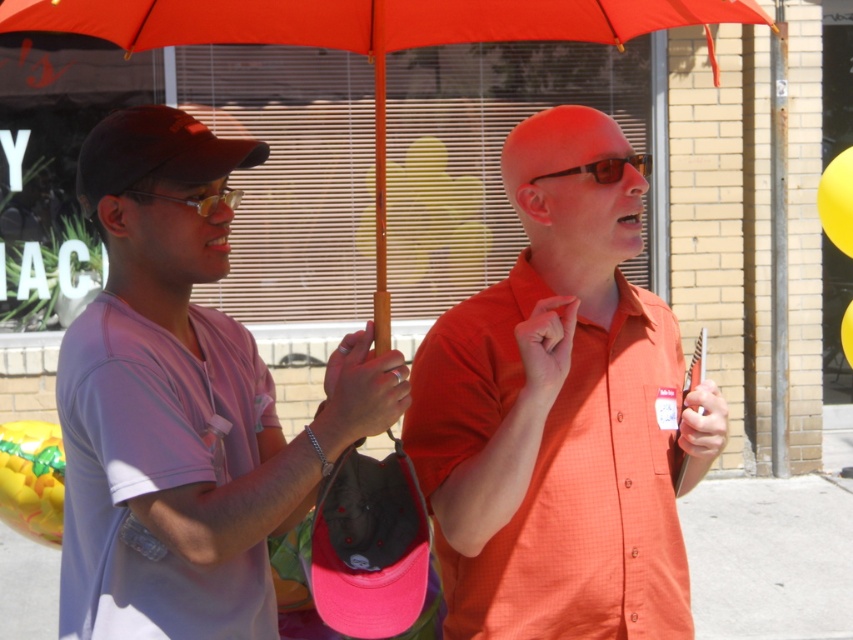
Question: Is yellow matte balloon at upper right positioned before matte yellow goggles at center?

Choices:
 (A) no
 (B) yes

Answer: (A)

Question: Is orange matte shirt at center behind matte yellow goggles at center?

Choices:
 (A) yes
 (B) no

Answer: (B)

Question: From the image, what is the correct spatial relationship of orange matte shirt at center in relation to yellow rubber balloon at upper right?

Choices:
 (A) left
 (B) right

Answer: (A)

Question: Among these objects, which one is nearest to the camera?

Choices:
 (A) matte purple shirt at left
 (B) matte black sunglasses at center

Answer: (A)

Question: Which point is closer to the camera?

Choices:
 (A) (641, 166)
 (B) (230, 16)

Answer: (A)

Question: Which object is positioned farthest from the yellow matte balloon at upper right?

Choices:
 (A) orange matte shirt at center
 (B) yellow rubber balloon at upper right

Answer: (B)